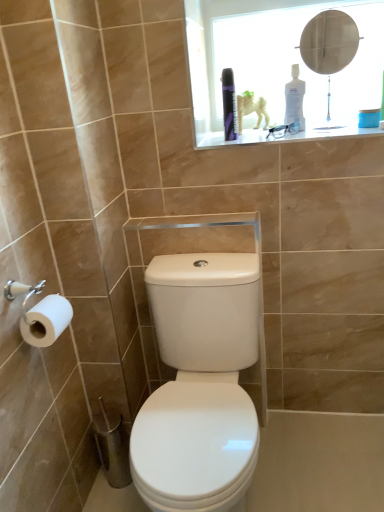
Question: Is white matte toilet paper at left positioned with its back to purple glossy can at upper center, which is the first toiletry from left to right?

Choices:
 (A) no
 (B) yes

Answer: (A)

Question: From a real-world perspective, is white matte toilet paper at left on top of purple glossy can at upper center, which appears as the 2th toiletry when viewed from the right?

Choices:
 (A) no
 (B) yes

Answer: (A)

Question: Is white matte toilet paper at left further to the viewer compared to purple glossy can at upper center, which is the first toiletry from left to right?

Choices:
 (A) no
 (B) yes

Answer: (A)

Question: Could you tell me if white matte toilet paper at left is facing purple glossy can at upper center, which is the first toiletry from left to right?

Choices:
 (A) no
 (B) yes

Answer: (A)

Question: Would you say white matte toilet paper at left is a long distance from purple glossy can at upper center, which is the first toiletry from left to right?

Choices:
 (A) no
 (B) yes

Answer: (A)

Question: Is transparent plastic medicine cabinet at upper center wider or thinner than metallic round mirror at upper center?

Choices:
 (A) thin
 (B) wide

Answer: (B)

Question: From a real-world perspective, is transparent plastic medicine cabinet at upper center physically located above or below metallic round mirror at upper center?

Choices:
 (A) below
 (B) above

Answer: (B)

Question: Considering the positions of transparent plastic medicine cabinet at upper center and metallic round mirror at upper center in the image, is transparent plastic medicine cabinet at upper center bigger or smaller than metallic round mirror at upper center?

Choices:
 (A) small
 (B) big

Answer: (B)

Question: Would you say transparent plastic medicine cabinet at upper center is inside or outside metallic round mirror at upper center?

Choices:
 (A) outside
 (B) inside

Answer: (A)

Question: Considering the positions of white plastic bottle at upper center, positioned as the first toiletry in right-to-left order, and transparent plastic medicine cabinet at upper center in the image, is white plastic bottle at upper center, positioned as the first toiletry in right-to-left order, taller or shorter than transparent plastic medicine cabinet at upper center?

Choices:
 (A) short
 (B) tall

Answer: (A)

Question: Based on their positions, is white plastic bottle at upper center, the second toiletry when ordered from left to right, located to the left or right of transparent plastic medicine cabinet at upper center?

Choices:
 (A) left
 (B) right

Answer: (A)

Question: Is point (296, 102) closer or farther from the camera than point (337, 88)?

Choices:
 (A) farther
 (B) closer

Answer: (A)

Question: From a real-world perspective, is white plastic bottle at upper center, positioned as the first toiletry in right-to-left order, positioned above or below transparent plastic medicine cabinet at upper center?

Choices:
 (A) below
 (B) above

Answer: (A)

Question: From the image's perspective, is metallic round mirror at upper center positioned above or below white plastic bottle at upper center, positioned as the first toiletry in right-to-left order?

Choices:
 (A) above
 (B) below

Answer: (A)

Question: Considering the positions of point (329, 105) and point (292, 120), is point (329, 105) closer or farther from the camera than point (292, 120)?

Choices:
 (A) farther
 (B) closer

Answer: (B)